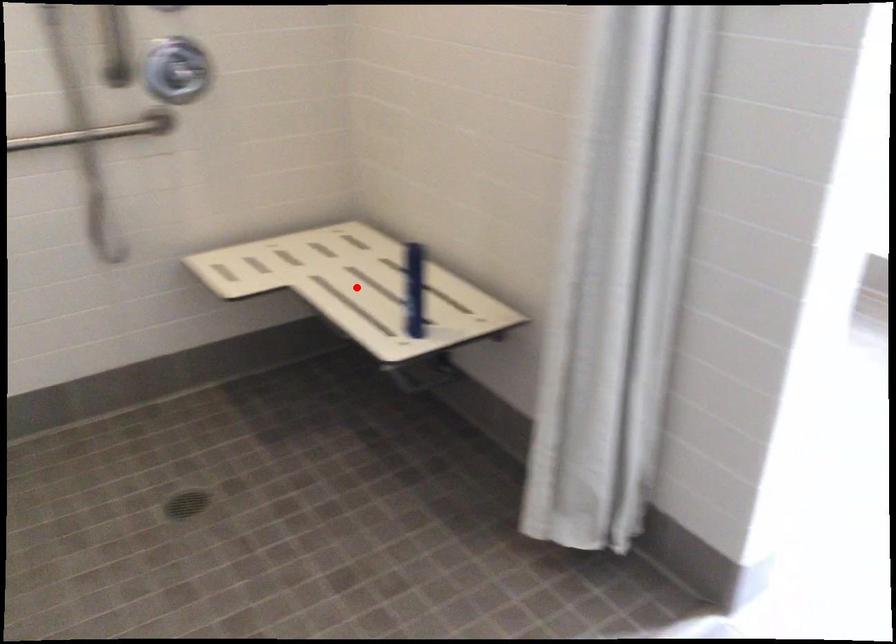
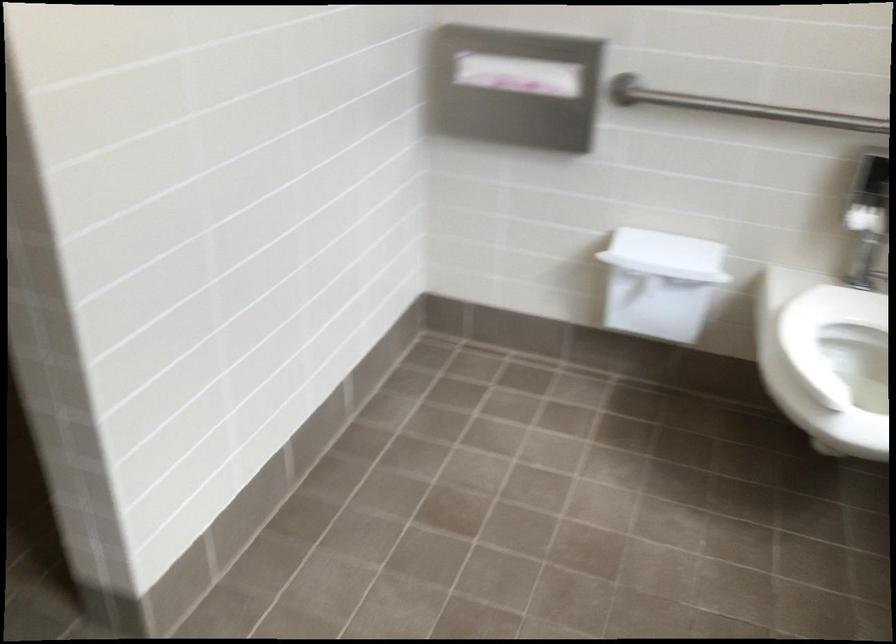
Question: I am providing you with two images of the same scene from different viewpoints. A red point is marked on the first image. At the location where the point appears in image 1, is it still visible in image 2?

Choices:
 (A) Yes
 (B) No

Answer: (B)